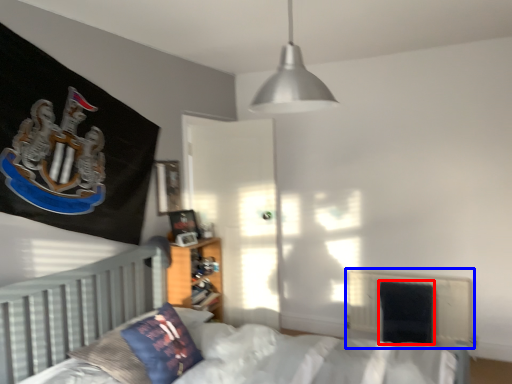
Question: Which of the following is the closest to the observer, armchair (highlighted by a red box) or radiator (highlighted by a blue box)?

Choices:
 (A) armchair
 (B) radiator

Answer: (B)